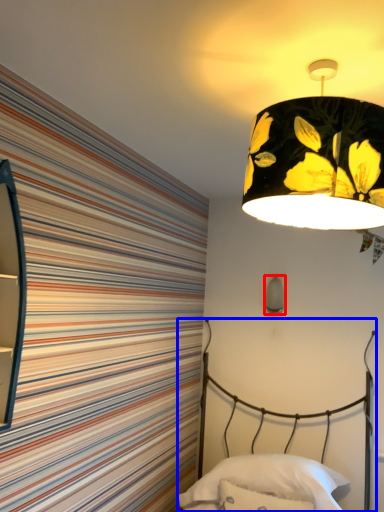
Question: Which object appears farthest to the camera in this image, lamp (highlighted by a red box) or bed (highlighted by a blue box)?

Choices:
 (A) lamp
 (B) bed

Answer: (A)